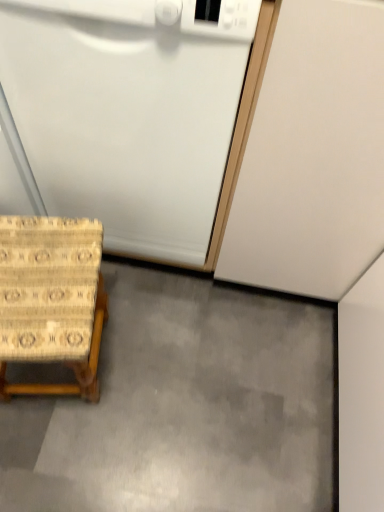
You are a GUI agent. You are given a task and a screenshot of the screen. Output one action in this format:
    pyautogui.click(x=<x>, y=<y>)
    Task: Click on the vacant area that is in front of beige woven stool at lower left
    
    Given the screenshot: What is the action you would take?
    pyautogui.click(x=62, y=456)